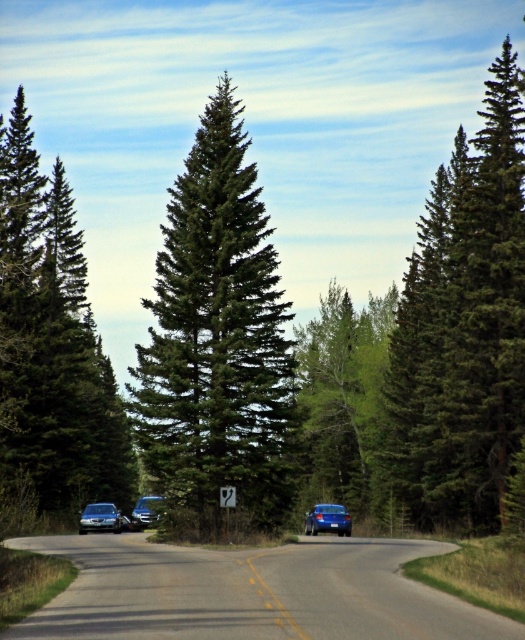
Question: Is green textured pine tree at left thinner than satin silver sedan at lower left?

Choices:
 (A) no
 (B) yes

Answer: (A)

Question: Which point is farther to the camera?

Choices:
 (A) green textured pine tree at left
 (B) green needle-like tree at center

Answer: (A)

Question: Does green textured pine tree at left appear on the left side of shiny blue sedan at center?

Choices:
 (A) no
 (B) yes

Answer: (B)

Question: Can you confirm if satin silver sedan at lower left is wider than metallic silver sedan at center?

Choices:
 (A) no
 (B) yes

Answer: (A)

Question: Which of the following is the closest to the observer?

Choices:
 (A) satin silver sedan at lower left
 (B) metallic silver sedan at center
 (C) green needle-like tree at center

Answer: (C)

Question: Which point appears closest to the camera in this image?

Choices:
 (A) (320, 512)
 (B) (151, 500)
 (C) (1, 465)
 (D) (87, 524)

Answer: (B)